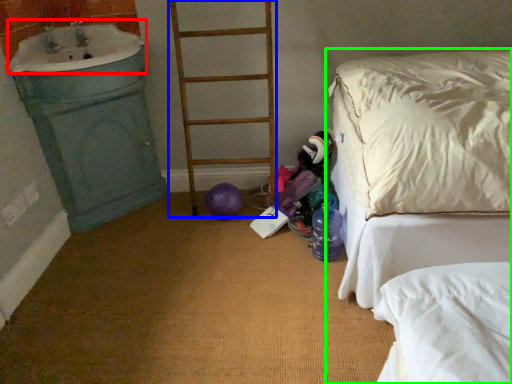
Question: Estimate the real-world distances between objects in this image. Which object is closer to sink (highlighted by a red box), ladder (highlighted by a blue box) or bed (highlighted by a green box)?

Choices:
 (A) ladder
 (B) bed

Answer: (A)